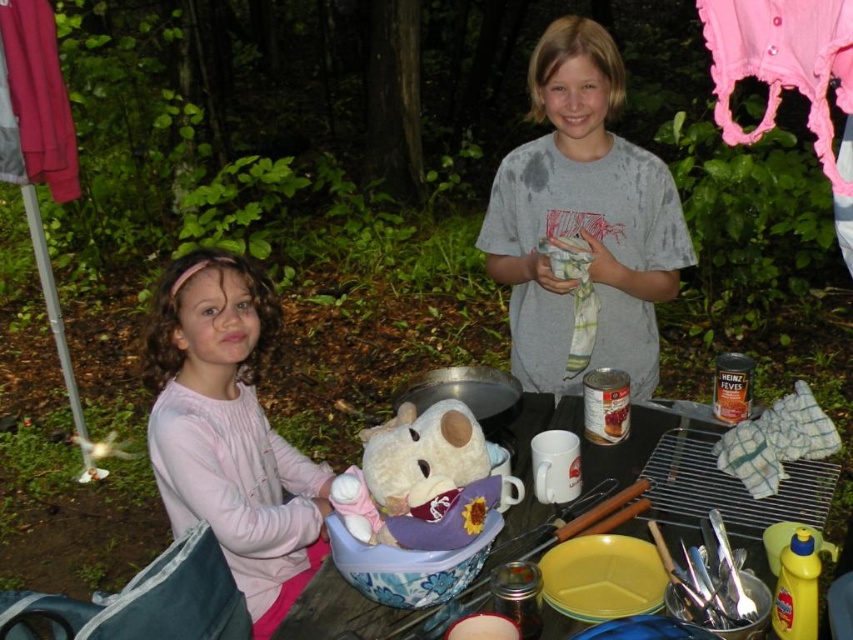
Who is lower down, gray cotton shirt at center or floral plastic bowl at center?

floral plastic bowl at center is below.

Who is positioned more to the right, gray cotton shirt at center or floral plastic bowl at center?

gray cotton shirt at center is more to the right.

Image resolution: width=853 pixels, height=640 pixels. Find the location of `gray cotton shirt at center`. gray cotton shirt at center is located at coordinates (583, 218).

Between gray cotton shirt at center and pink fabric at upper left, which one appears on the left side from the viewer's perspective?

pink fabric at upper left

The image size is (853, 640). What do you see at coordinates (583, 218) in the screenshot?
I see `gray cotton shirt at center` at bounding box center [583, 218].

I want to click on gray cotton shirt at center, so [x=583, y=218].

Is the position of pink cotton shirt at left more distant than that of fluffy white teddy bear at center?

Yes.

Does pink cotton shirt at left have a smaller size compared to fluffy white teddy bear at center?

Incorrect, pink cotton shirt at left is not smaller in size than fluffy white teddy bear at center.

Is point (171, 333) more distant than point (444, 442)?

That is True.

Locate an element on the screen. This screenshot has width=853, height=640. pink cotton shirt at left is located at coordinates (230, 433).